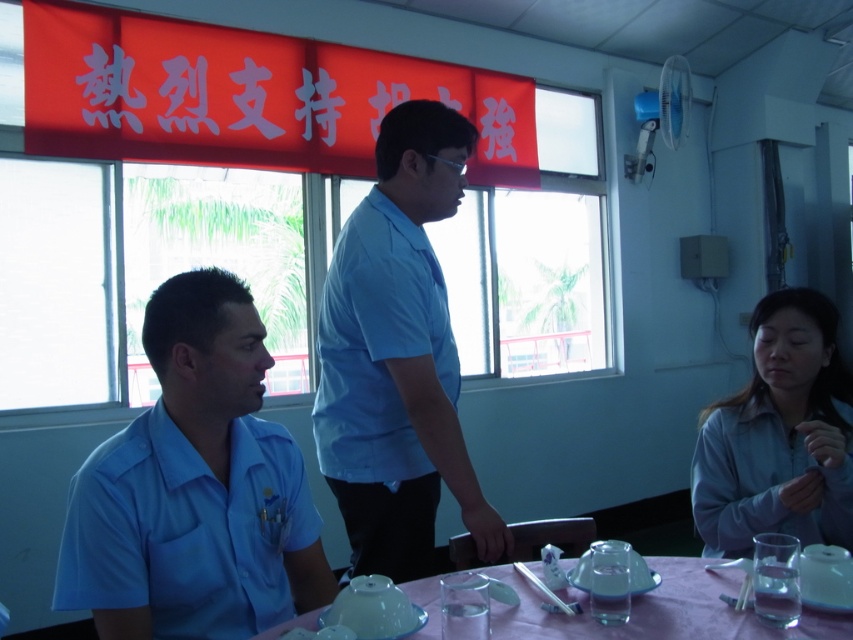
Between light blue shirt at center and light blue fabric shirt at lower right, which one has more height?

Standing taller between the two is light blue shirt at center.

Does light blue shirt at center have a smaller size compared to light blue fabric shirt at lower right?

Actually, light blue shirt at center might be larger than light blue fabric shirt at lower right.

The width and height of the screenshot is (853, 640). Describe the element at coordinates (397, 356) in the screenshot. I see `light blue shirt at center` at that location.

I want to click on light blue shirt at center, so click(x=397, y=356).

This screenshot has height=640, width=853. Identify the location of light blue shirt at center. (397, 356).

Does light blue shirt at center have a smaller size compared to pink plastic table at lower center?

No.

Does point (444, 298) lie in front of point (698, 596)?

No, it is behind (698, 596).

The height and width of the screenshot is (640, 853). I want to click on light blue shirt at center, so click(397, 356).

Locate an element on the screen. Image resolution: width=853 pixels, height=640 pixels. matte blue shirt at left is located at coordinates (195, 486).

Does matte blue shirt at left appear on the right side of pink plastic table at lower center?

Incorrect, matte blue shirt at left is not on the right side of pink plastic table at lower center.

What do you see at coordinates (195, 486) in the screenshot?
I see `matte blue shirt at left` at bounding box center [195, 486].

Identify the location of matte blue shirt at left. This screenshot has width=853, height=640. (195, 486).